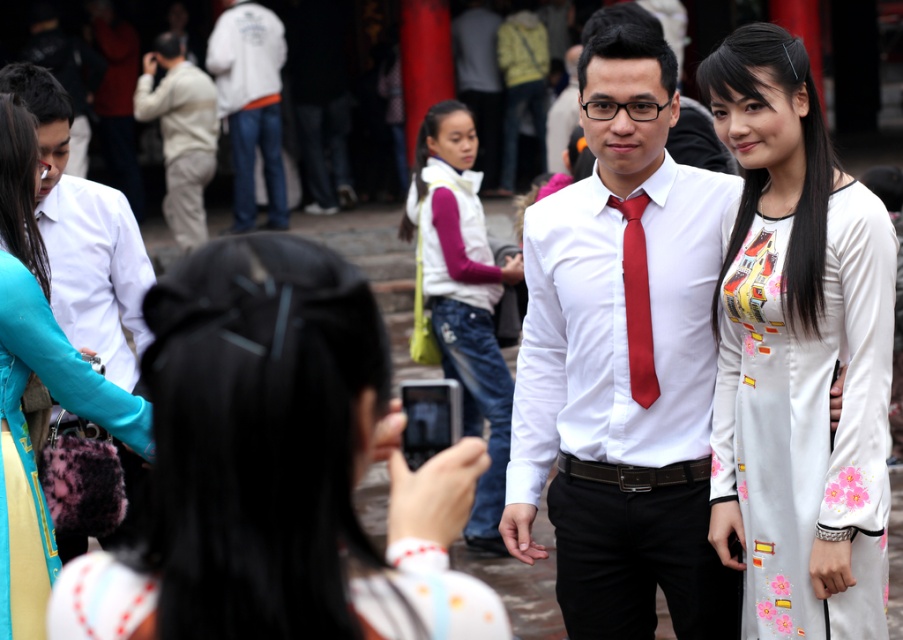
Question: Among these points, which one is nearest to the camera?

Choices:
 (A) (108, 387)
 (B) (209, 120)
 (C) (594, 589)

Answer: (A)

Question: Which of the following is the closest to the observer?

Choices:
 (A) (636, 323)
 (B) (14, 355)

Answer: (B)

Question: Is white cotton jacket at upper center positioned in front of light beige cotton shirt at upper left?

Choices:
 (A) yes
 (B) no

Answer: (B)

Question: Among these objects, which one is nearest to the camera?

Choices:
 (A) light beige cotton shirt at upper left
 (B) white glossy shirt at center
 (C) white cotton dress at center

Answer: (C)

Question: Does white cotton dress at center have a greater width compared to white cotton jacket at upper center?

Choices:
 (A) yes
 (B) no

Answer: (A)

Question: Does white glossy shirt at center have a larger size compared to white cotton vest at center?

Choices:
 (A) yes
 (B) no

Answer: (A)